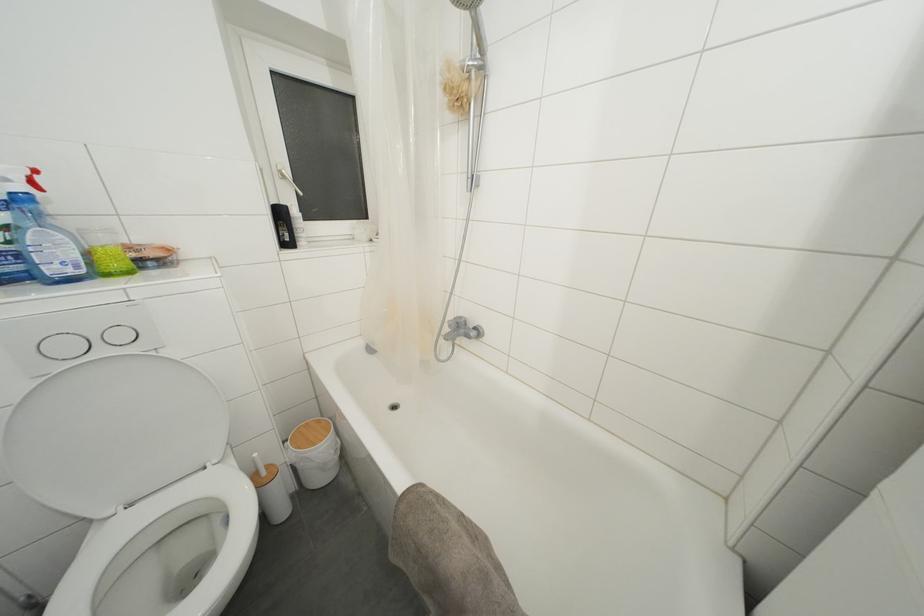
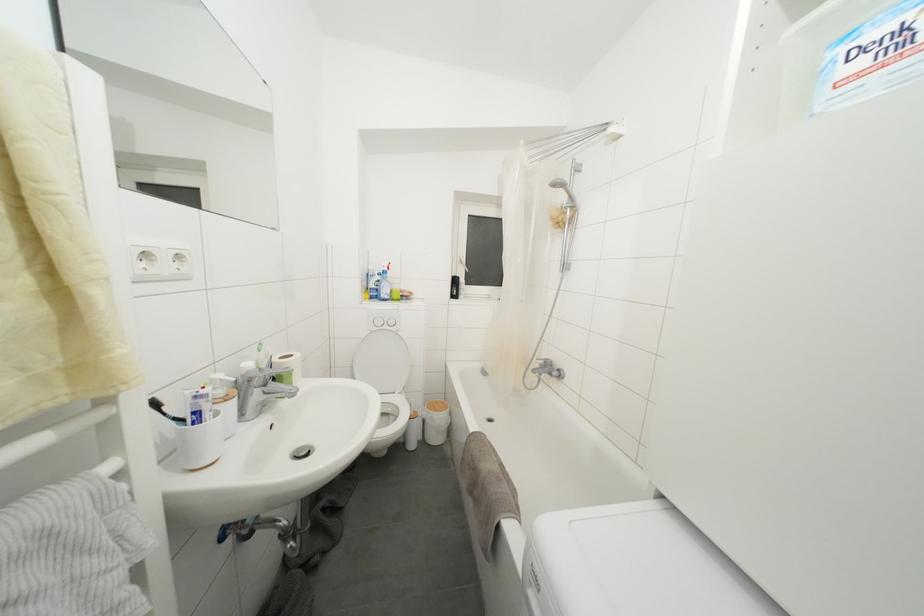
In the second image, find the point that corresponds to point 451,323 in the first image.

(540, 362)